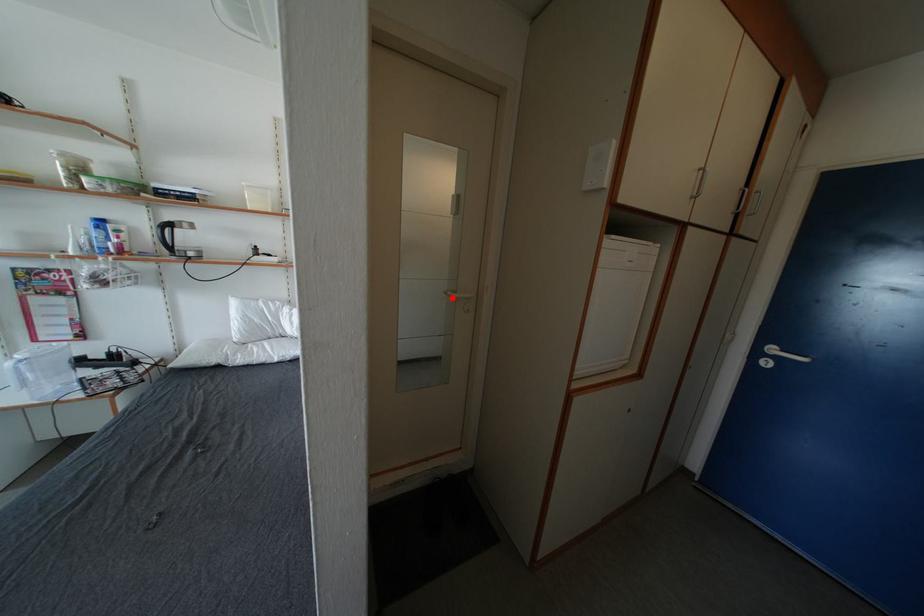
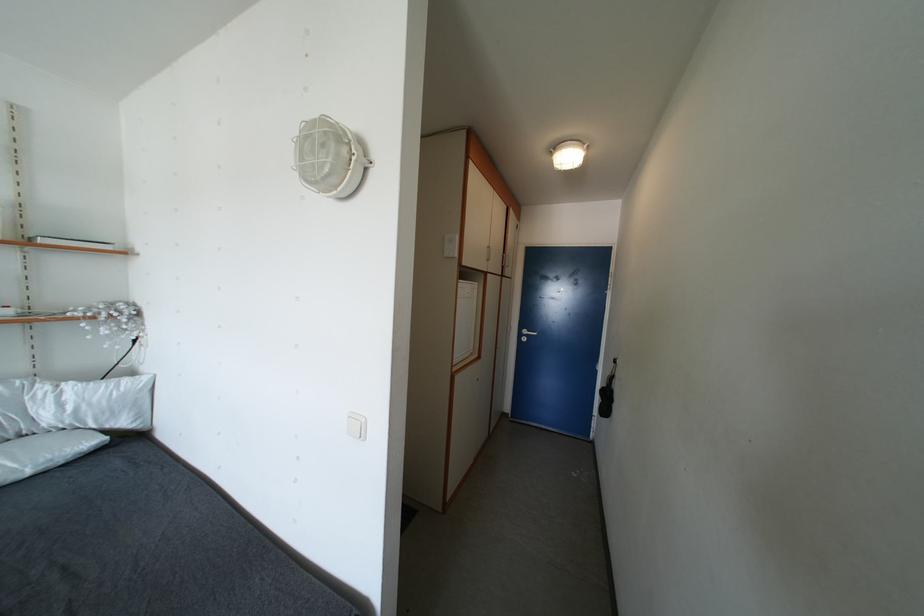
Question: I am providing you with two images of the same scene from different viewpoints. A red point is marked on the first image. Is the red point's position out of view in image 2?

Choices:
 (A) Yes
 (B) No

Answer: (A)